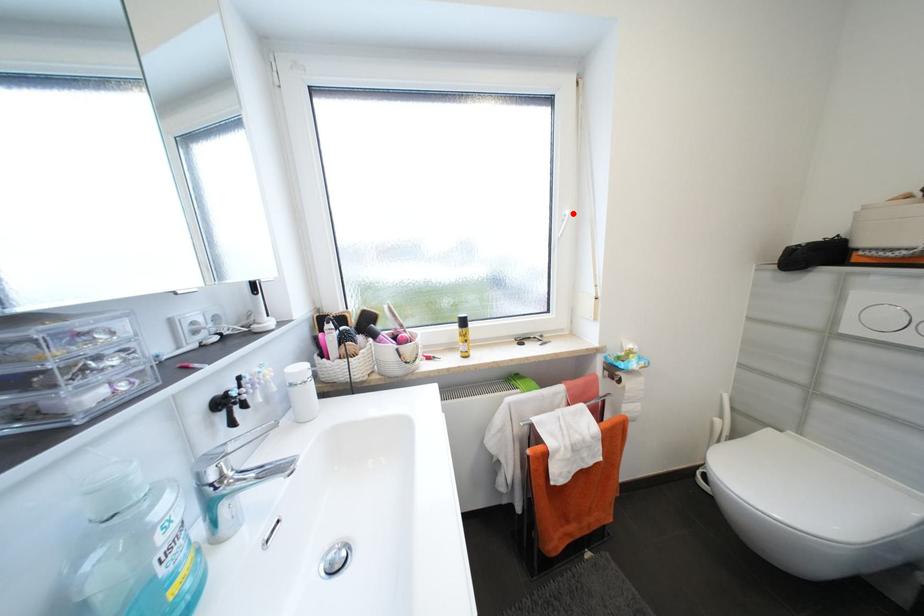
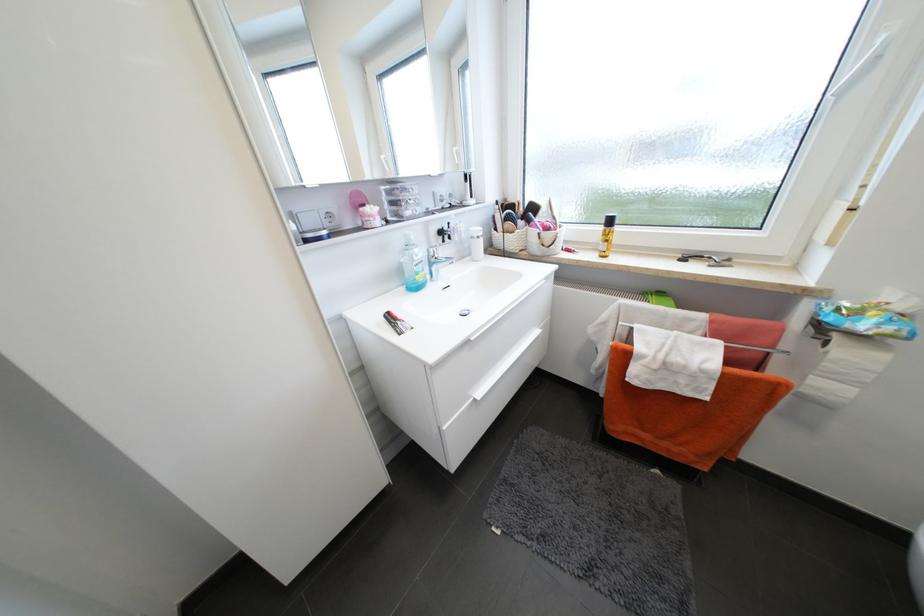
Question: I am providing you with two images of the same scene from different viewpoints. Given a red point in image1, look at the same physical point in image2. Is it:

Choices:
 (A) Closer to the viewpoint
 (B) Farther from the viewpoint

Answer: (B)